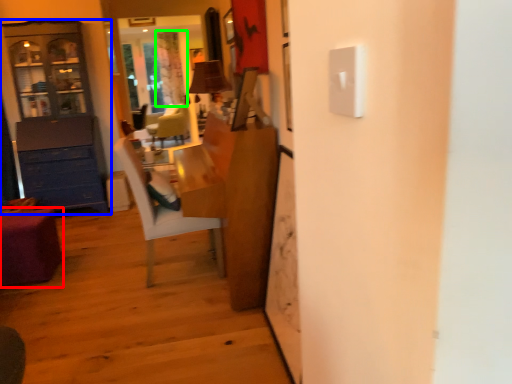
Question: Estimate the real-world distances between objects in this image. Which object is farther from desk (highlighted by a red box), cabinetry (highlighted by a blue box) or curtain (highlighted by a green box)?

Choices:
 (A) cabinetry
 (B) curtain

Answer: (B)